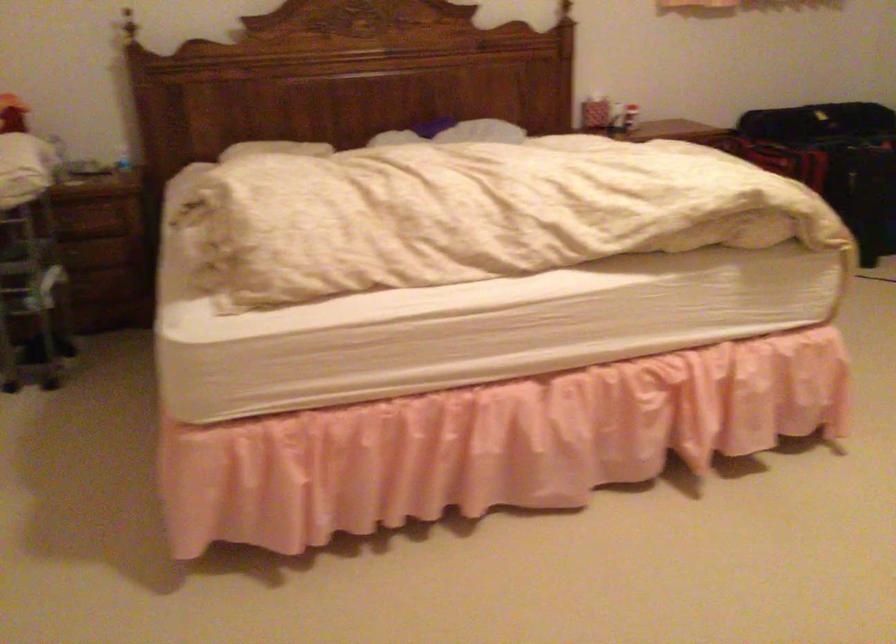
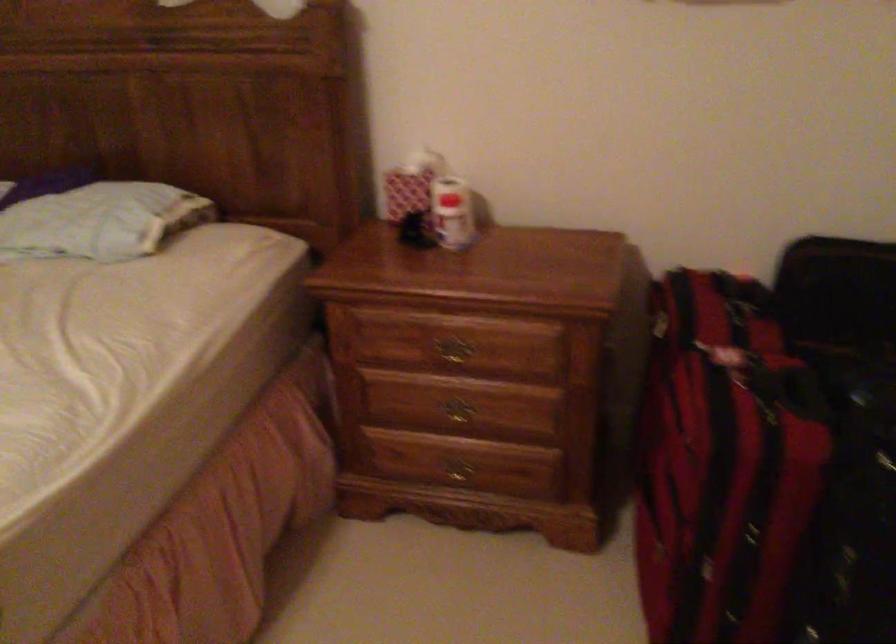
Where in the second image is the point corresponding to (x=599, y=84) from the first image?

(410, 184)